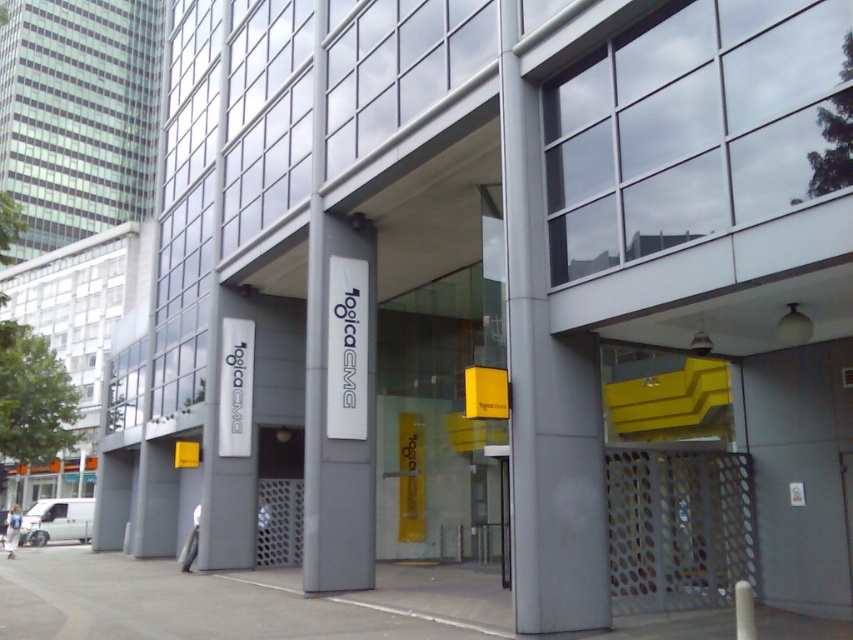
You are a delivery driver approaching the modern building and need to park your white matte van at lower left near the entrance. The parking spot is directly in front of the gray metallic sign at center. Can you park your van there without blocking the sign?

The gray metallic sign at center is positioned on the right side of white matte van at lower left, so parking the van directly in front of the sign would block the sign since the van is to the left of the sign and the parking spot is in front of it.

You are standing in front of the modern building and want to locate the two points mentioned. Which point, point (352,417) or point (71,540), is positioned closer to you?

Point (352,417) is closer to the viewer than point (71,540).

You are standing 50 feet away from the modern building. You see the gray metallic sign at center. Can you walk closer to it without crossing the property boundary, which is 30 feet away from the sign?

The gray metallic sign at center is 43.01 feet away from the viewer. Since the property boundary is 30 feet away from the sign, you can walk closer to it as long as you stay within the 30 feet boundary from the sign. However, you are currently 50 feet away, so you can approach up to 30 feet from the sign, which would place you 13.01 feet closer than your current position.